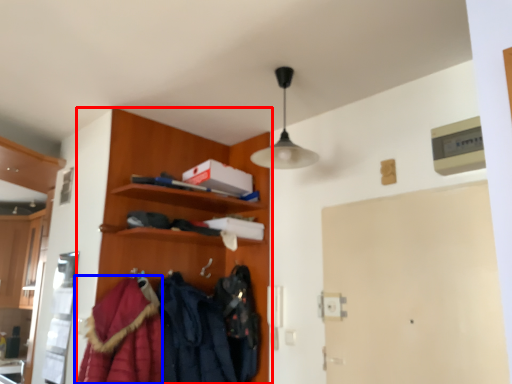
Question: Which object is further to the camera taking this photo, dresser (highlighted by a red box) or cloak (highlighted by a blue box)?

Choices:
 (A) dresser
 (B) cloak

Answer: (A)